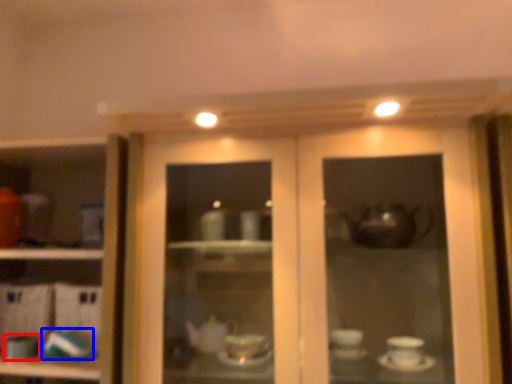
Question: Which point is further to the camera, tableware (highlighted by a red box) or tableware (highlighted by a blue box)?

Choices:
 (A) tableware
 (B) tableware

Answer: (B)